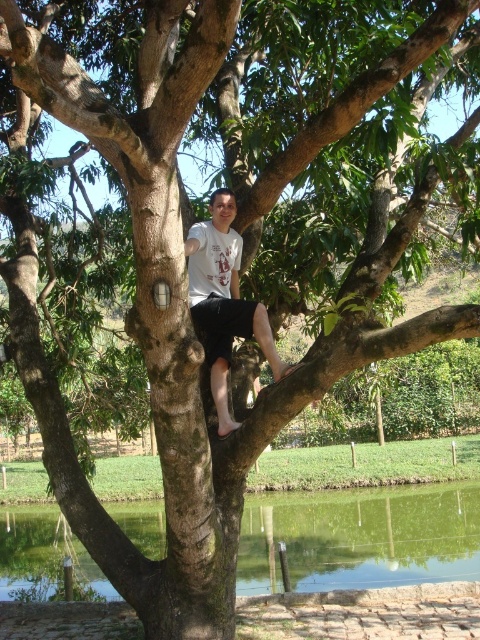
Does green smooth water at lower center appear on the right side of white cotton t-shirt at center?

Incorrect, green smooth water at lower center is not on the right side of white cotton t-shirt at center.

From the picture: Between green smooth water at lower center and white cotton t-shirt at center, which one appears on the right side from the viewer's perspective?

From the viewer's perspective, white cotton t-shirt at center appears more on the right side.

Which is in front, point (338, 512) or point (216, 216)?

Point (216, 216)

Where is `green smooth water at lower center`? green smooth water at lower center is located at coordinates (360, 538).